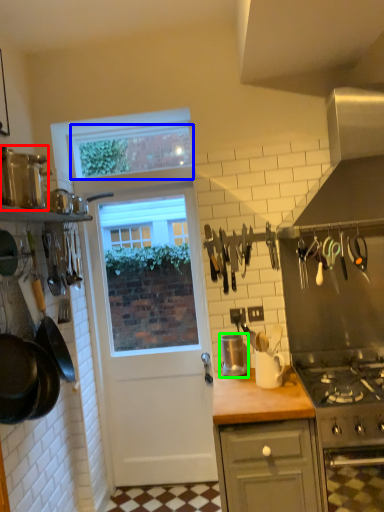
Question: Considering the real-world distances, which object is farthest from kitchen appliance (highlighted by a red box)? window screen (highlighted by a blue box) or kitchen appliance (highlighted by a green box)?

Choices:
 (A) window screen
 (B) kitchen appliance

Answer: (B)